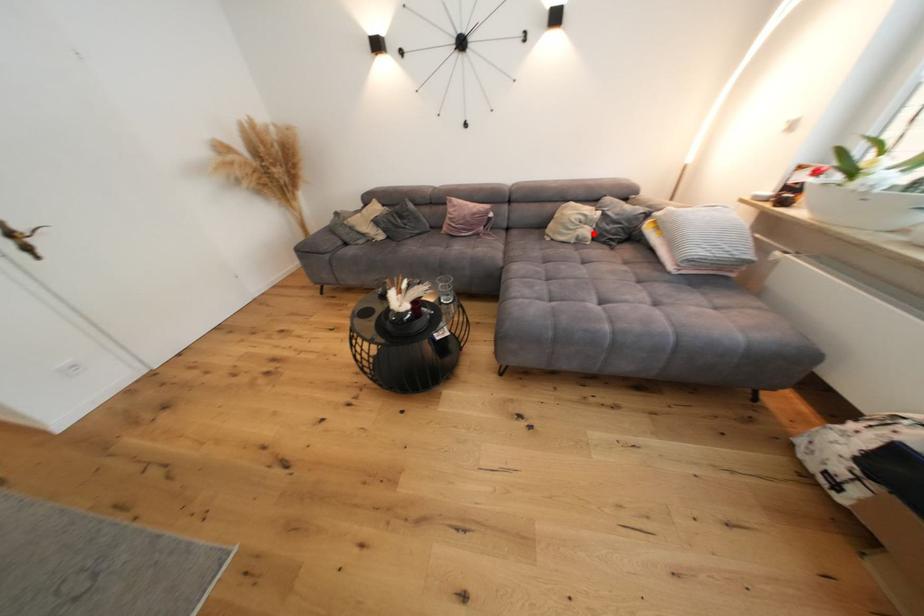
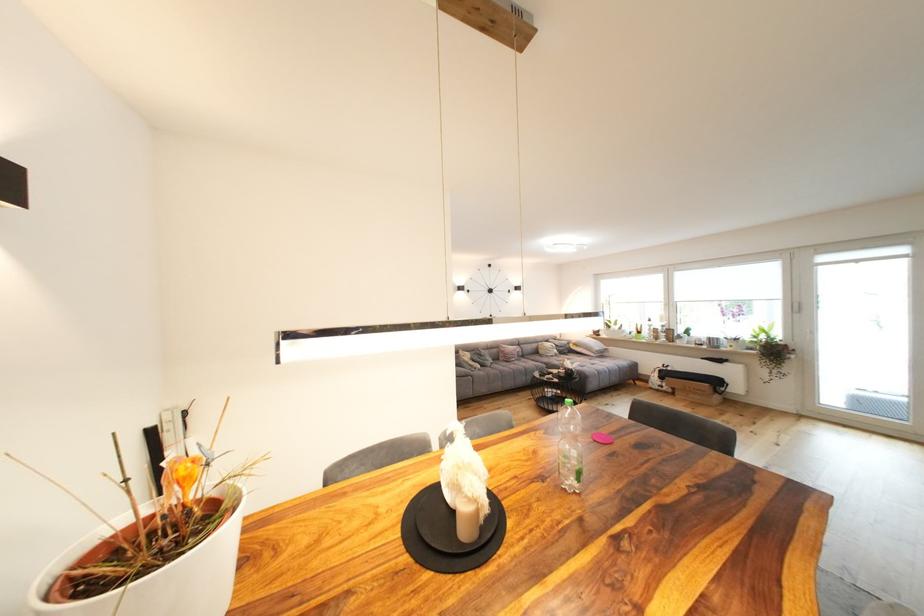
Find the pixel in the second image that matches the highlighted location in the first image.

(563, 353)